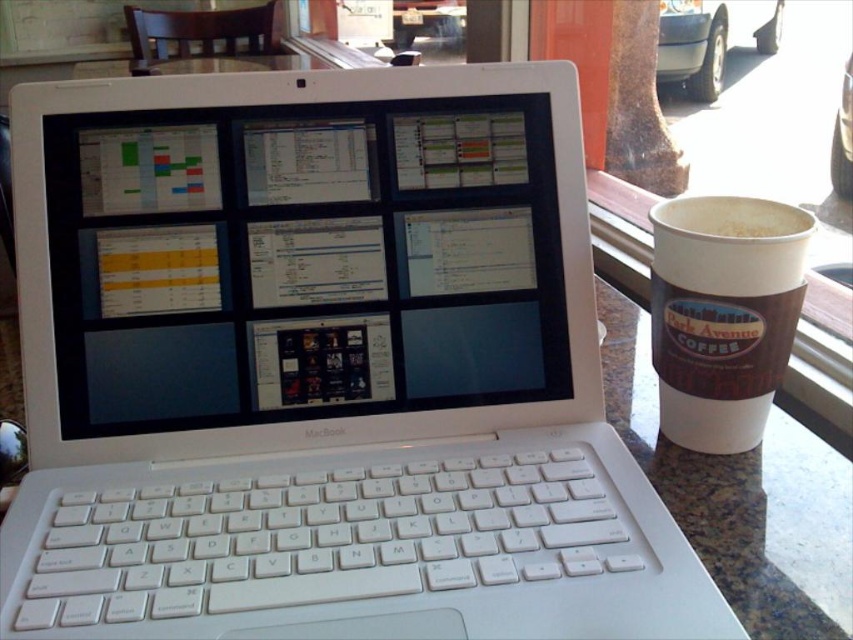
Can you confirm if white glossy laptop at center is positioned below brown paper cup at right?

Incorrect, white glossy laptop at center is not positioned below brown paper cup at right.

The height and width of the screenshot is (640, 853). What do you see at coordinates (299, 248) in the screenshot?
I see `white glossy laptop at center` at bounding box center [299, 248].

In order to click on white glossy laptop at center in this screenshot , I will do click(x=299, y=248).

Who is shorter, white glossy laptop at center or white paper cup at upper right?

With less height is white paper cup at upper right.

Can you confirm if white glossy laptop at center is smaller than white paper cup at upper right?

No, white glossy laptop at center is not smaller than white paper cup at upper right.

Does point (49, 392) lie behind point (750, 230)?

No, (49, 392) is closer to viewer.

You are a GUI agent. You are given a task and a screenshot of the screen. Output one action in this format:
    pyautogui.click(x=<x>, y=<y>)
    Task: Click on the white glossy laptop at center
    Image resolution: width=853 pixels, height=640 pixels.
    Given the screenshot: What is the action you would take?
    pyautogui.click(x=299, y=248)

Is the position of white plastic keyboard at center less distant than that of white paper cup at upper right?

Yes, white plastic keyboard at center is in front of white paper cup at upper right.

Between point (204, 620) and point (782, 214), which one is positioned behind?

The point (782, 214) is more distant.

Image resolution: width=853 pixels, height=640 pixels. What are the coordinates of `white plastic keyboard at center` in the screenshot? It's located at (323, 541).